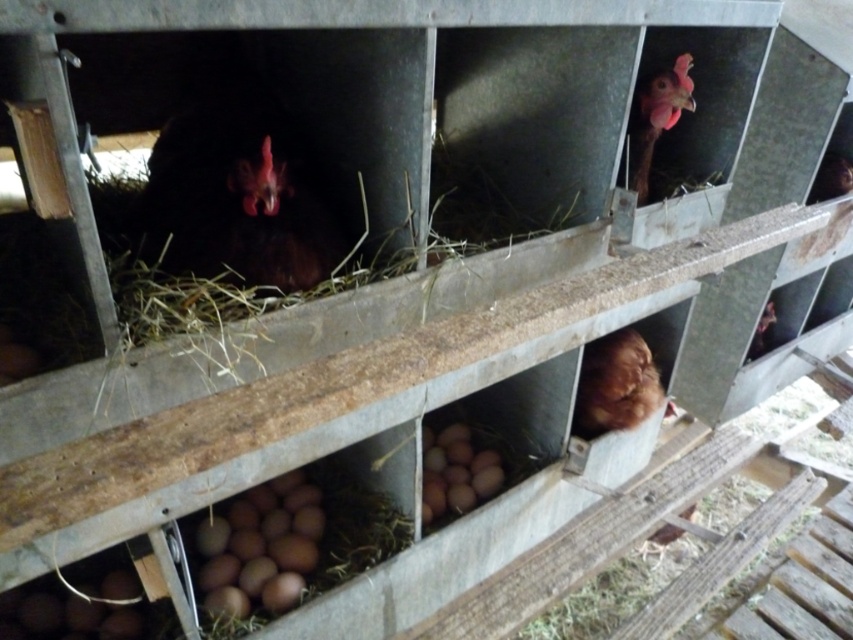
Which is more to the right, brown matte eggs at center or brown fluffy chicken at lower center?

brown fluffy chicken at lower center is more to the right.

Is brown matte eggs at center further to the viewer compared to brown fluffy chicken at lower center?

No, it is not.

Does point (224, 596) lie in front of point (612, 371)?

Yes, point (224, 596) is closer to viewer.

Where is `brown matte eggs at center`? This screenshot has height=640, width=853. brown matte eggs at center is located at coordinates (260, 547).

Does black matte chicken at center come in front of brown fluffy chicken at lower center?

Yes, it is in front of brown fluffy chicken at lower center.

Does point (140, 230) come in front of point (572, 422)?

Yes, it is in front of point (572, 422).

Identify the location of black matte chicken at center. (234, 202).

Is brown matte eggs at center below pink matte chicken at upper right?

Indeed, brown matte eggs at center is positioned under pink matte chicken at upper right.

Can you confirm if brown matte eggs at center is bigger than pink matte chicken at upper right?

Yes.

This screenshot has width=853, height=640. Describe the element at coordinates (260, 547) in the screenshot. I see `brown matte eggs at center` at that location.

I want to click on brown matte eggs at center, so click(260, 547).